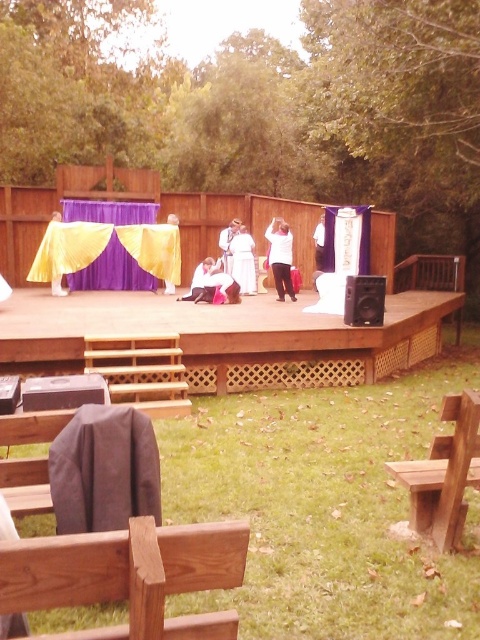
Who is shorter, white cotton dress at center or white fabric at center?

With less height is white fabric at center.

You are a GUI agent. You are given a task and a screenshot of the screen. Output one action in this format:
    pyautogui.click(x=<x>, y=<y>)
    Task: Click on the white cotton dress at center
    The image size is (480, 640).
    Given the screenshot: What is the action you would take?
    pyautogui.click(x=243, y=260)

Between point (240, 250) and point (321, 262), which one is positioned behind?

The point (240, 250) is more distant.

You are a GUI agent. You are given a task and a screenshot of the screen. Output one action in this format:
    pyautogui.click(x=<x>, y=<y>)
    Task: Click on the white cotton dress at center
    The image size is (480, 640).
    Given the screenshot: What is the action you would take?
    pyautogui.click(x=243, y=260)

Is white matte shirt at center bigger than white cotton dress at center?

Correct, white matte shirt at center is larger in size than white cotton dress at center.

Is point (278, 250) more distant than point (238, 228)?

No, (278, 250) is in front of (238, 228).

Identify the location of white matte shirt at center. (280, 257).

I want to click on white matte shirt at center, so click(x=280, y=257).

Based on the photo, does wooden bench at lower left have a greater width compared to white cotton dress at center?

Yes, wooden bench at lower left is wider than white cotton dress at center.

The image size is (480, 640). What are the coordinates of `wooden bench at lower left` in the screenshot? It's located at (130, 576).